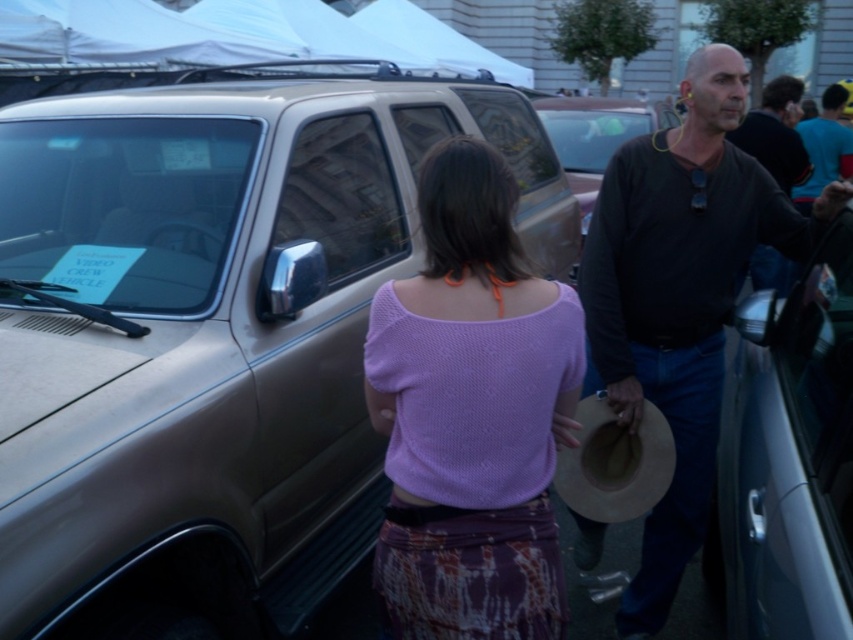
You are a photographer trying to capture the purple knit top at center and the metallic silver car door at right in the same frame. Based on their heights, which object should you focus on first to ensure both are in the frame?

The purple knit top at center is not as tall as the metallic silver car door at right, so you should focus on the metallic silver car door at right first to ensure both are in the frame.

From the picture: You are a photographer setting up a shot of the purple knit top at center and the metallic silver car door at right. Which object should you focus on first if you want to capture both in a single frame without moving the camera?

The purple knit top at center has a smaller size compared to the metallic silver car door at right, so you should focus on the metallic silver car door at right first to ensure proper depth of field for both objects.

You are a fashion designer observing the two tops in the image. The purple knit top at center and the black matte shirt at center. Which one is closer to the camera?

Both the purple knit top at center and the black matte shirt at center are positioned at the same distance from the camera since they are both at the center of the image.